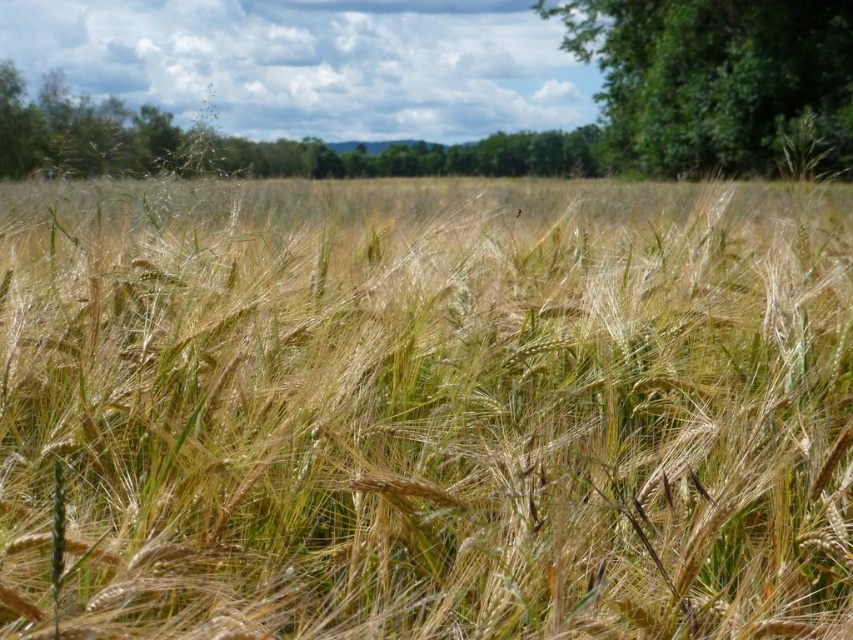
Question: Does golden wheat field at center have a lesser width compared to green leafy tree at upper right?

Choices:
 (A) no
 (B) yes

Answer: (B)

Question: Does golden wheat field at center have a lesser width compared to green leafy tree at upper right?

Choices:
 (A) no
 (B) yes

Answer: (B)

Question: Considering the relative positions of golden wheat field at center and green leafy tree at upper right in the image provided, where is golden wheat field at center located with respect to green leafy tree at upper right?

Choices:
 (A) above
 (B) below

Answer: (B)

Question: Which point is closer to the camera taking this photo?

Choices:
 (A) (666, 374)
 (B) (724, 22)

Answer: (A)